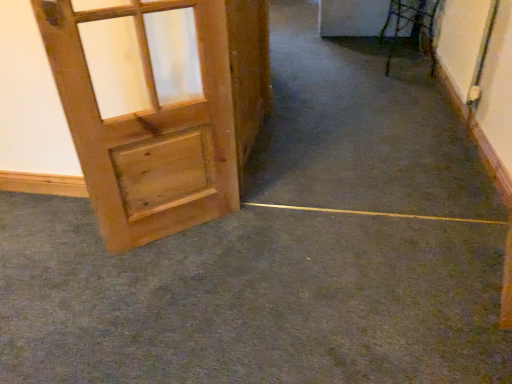
Question: From a real-world perspective, is green carpet at lower left physically located above or below natural wood door at left?

Choices:
 (A) below
 (B) above

Answer: (A)

Question: From the image's perspective, relative to natural wood door at left, is green carpet at lower left above or below?

Choices:
 (A) below
 (B) above

Answer: (A)

Question: Visually, is green carpet at lower left positioned to the left or to the right of natural wood door at left?

Choices:
 (A) right
 (B) left

Answer: (A)

Question: Is natural wood door at left wider or thinner than green carpet at lower left?

Choices:
 (A) thin
 (B) wide

Answer: (A)

Question: Considering the positions of point (155, 140) and point (100, 372), is point (155, 140) closer or farther from the camera than point (100, 372)?

Choices:
 (A) closer
 (B) farther

Answer: (B)

Question: Considering the positions of natural wood door at left and green carpet at lower left in the image, is natural wood door at left taller or shorter than green carpet at lower left?

Choices:
 (A) tall
 (B) short

Answer: (A)

Question: From a real-world perspective, is natural wood door at left physically located above or below green carpet at lower left?

Choices:
 (A) below
 (B) above

Answer: (B)